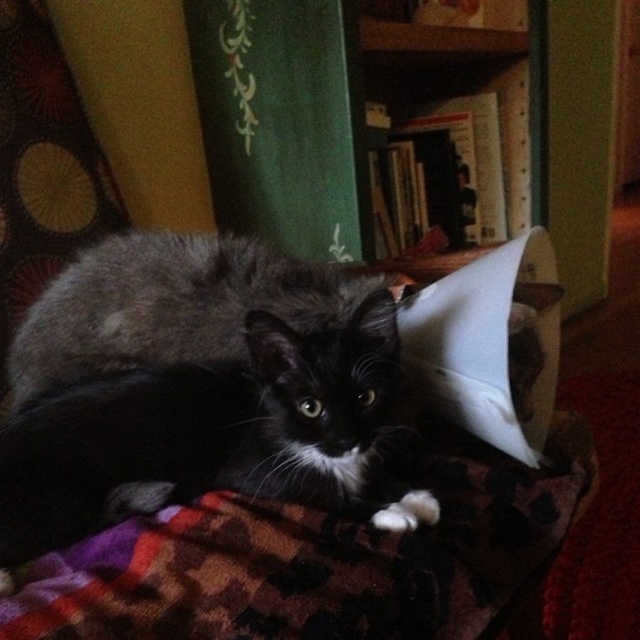
You are a veterinarian examining a cat. You notice the cat has an e collar and is lying on a patterned blanket. How does the height of the black fur cat at center compare to the fluffy black cat at center?

The black fur cat at center is shorter than the fluffy black cat at center.

What are the coordinates of the black fur cat at center?

The black fur cat at center is located at coordinates point [204,432].